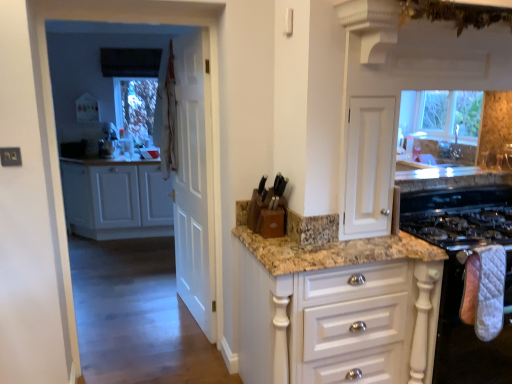
The image size is (512, 384). Describe the element at coordinates (268, 209) in the screenshot. I see `wooden knife block at center, the 1th appliance positioned from the top` at that location.

You are a GUI agent. You are given a task and a screenshot of the screen. Output one action in this format:
    pyautogui.click(x=<x>, y=<y>)
    Task: Click on the white wood cabinets at left, which ranks as the second cabinetry in front-to-back order
    
    Given the screenshot: What is the action you would take?
    pyautogui.click(x=116, y=199)

Identify the location of white wooden door at center. Image resolution: width=512 pixels, height=384 pixels. (194, 181).

The width and height of the screenshot is (512, 384). In order to click on white quilted oven mitt at lower right in this screenshot , I will do `click(467, 340)`.

Where is `white quilted oven mitt at right, which is counted as the second appliance, starting from the top`? white quilted oven mitt at right, which is counted as the second appliance, starting from the top is located at coordinates (463, 274).

Considering the relative sizes of white glossy cabinet at center, the first cabinetry in the right-to-left sequence, and wooden knife block at center, the 1th appliance positioned from the top, in the image provided, is white glossy cabinet at center, the first cabinetry in the right-to-left sequence, bigger than wooden knife block at center, the 1th appliance positioned from the top,?

Correct, white glossy cabinet at center, the first cabinetry in the right-to-left sequence, is larger in size than wooden knife block at center, the 1th appliance positioned from the top.

Is white glossy cabinet at center, which is counted as the first cabinetry, starting from the front, not within wooden knife block at center, the 1th appliance positioned from the top?

Yes.

From a real-world perspective, is white glossy cabinet at center, which is counted as the first cabinetry, starting from the front, on top of wooden knife block at center, the 1th appliance positioned from the top?

No, from a real-world perspective, white glossy cabinet at center, which is counted as the first cabinetry, starting from the front, is not on top of wooden knife block at center, the 1th appliance positioned from the top.

Considering the sizes of objects white glossy cabinet at center, the first cabinetry in the right-to-left sequence, and wooden knife block at center, the 1th appliance in the left-to-right sequence, in the image provided, who is taller, white glossy cabinet at center, the first cabinetry in the right-to-left sequence, or wooden knife block at center, the 1th appliance in the left-to-right sequence,?

white glossy cabinet at center, the first cabinetry in the right-to-left sequence, is taller.

Would you say white wooden door at center contains white glossy cabinet at center, which is the 2th cabinetry in left-to-right order?

That's incorrect, white glossy cabinet at center, which is the 2th cabinetry in left-to-right order, is not inside white wooden door at center.

From a real-world perspective, who is located higher, white wooden door at center or white glossy cabinet at center, which is the 2th cabinetry in left-to-right order?

white wooden door at center is physically above.

From a real-world perspective, who is located higher, white wooden door at center or wooden knife block at center, the 1th appliance in the left-to-right sequence?

In real-world perspective, wooden knife block at center, the 1th appliance in the left-to-right sequence, is above.

Considering the relative sizes of white wooden door at center and wooden knife block at center, the 1th appliance in the left-to-right sequence, in the image provided, is white wooden door at center thinner than wooden knife block at center, the 1th appliance in the left-to-right sequence,?

Yes.

Is white wooden door at center to the left of wooden knife block at center, positioned as the second appliance in right-to-left order, from the viewer's perspective?

Yes.

Is white wooden door at center inside the boundaries of wooden knife block at center, the 1th appliance in the left-to-right sequence, or outside?

white wooden door at center cannot be found inside wooden knife block at center, the 1th appliance in the left-to-right sequence.

Is wooden knife block at center, positioned as the second appliance in right-to-left order, aimed at white wood cabinets at left, which appears as the 2th cabinetry when viewed from the right?

No, wooden knife block at center, positioned as the second appliance in right-to-left order, does not turn towards white wood cabinets at left, which appears as the 2th cabinetry when viewed from the right.

Is point (252, 202) in front of point (86, 225)?

Yes, point (252, 202) is closer to viewer.

From the picture: Who is more distant, wooden knife block at center, positioned as the second appliance in right-to-left order, or white wood cabinets at left, acting as the first cabinetry starting from the back?

white wood cabinets at left, acting as the first cabinetry starting from the back, is further from the camera.

Can you tell me how much wooden knife block at center, positioned as the second appliance in right-to-left order, and white wood cabinets at left, which appears as the 2th cabinetry when viewed from the right, differ in facing direction?

The angular difference between wooden knife block at center, positioned as the second appliance in right-to-left order, and white wood cabinets at left, which appears as the 2th cabinetry when viewed from the right, is 9.22 degrees.

Which object is further away from the camera, white fabric curtain at upper left or white glossy cabinet at center, which is the 2th cabinetry in left-to-right order?

white fabric curtain at upper left is further from the camera.

Is white fabric curtain at upper left next to white glossy cabinet at center, which is the 2th cabinetry in left-to-right order, and touching it?

No, white fabric curtain at upper left is not touching white glossy cabinet at center, which is the 2th cabinetry in left-to-right order.

Is white fabric curtain at upper left oriented away from white glossy cabinet at center, which is counted as the first cabinetry, starting from the front?

No, white fabric curtain at upper left is not facing away from white glossy cabinet at center, which is counted as the first cabinetry, starting from the front.

Is white wood cabinets at left, which ranks as the second cabinetry in front-to-back order, surrounding white glossy cabinet at center, which is counted as the first cabinetry, starting from the front?

No, white glossy cabinet at center, which is counted as the first cabinetry, starting from the front, is not a part of white wood cabinets at left, which ranks as the second cabinetry in front-to-back order.

Is the depth of white wood cabinets at left, which is the first cabinetry from left to right, greater than that of white glossy cabinet at center, which is the 2th cabinetry in left-to-right order?

That is True.

Between white wood cabinets at left, which is the first cabinetry from left to right, and white glossy cabinet at center, which is the 2th cabinetry in left-to-right order, which one has larger size?

Bigger between the two is white wood cabinets at left, which is the first cabinetry from left to right.

Is white wood cabinets at left, which ranks as the second cabinetry in front-to-back order, to the left of white glossy cabinet at center, which is counted as the first cabinetry, starting from the front, from the viewer's perspective?

Yes, white wood cabinets at left, which ranks as the second cabinetry in front-to-back order, is to the left of white glossy cabinet at center, which is counted as the first cabinetry, starting from the front.

Is white wooden door at center located outside white quilted oven mitt at right, the 1th appliance in the bottom-to-top sequence?

white wooden door at center lies outside white quilted oven mitt at right, the 1th appliance in the bottom-to-top sequence,'s area.

Is white wooden door at center facing towards white quilted oven mitt at right, which is counted as the 1th appliance, starting from the right?

No, white wooden door at center is not oriented towards white quilted oven mitt at right, which is counted as the 1th appliance, starting from the right.

Who is more distant, white wooden door at center or white quilted oven mitt at right, which is counted as the second appliance, starting from the top?

white wooden door at center is further away from the camera.

This screenshot has width=512, height=384. Find the location of `cabinetry lying on the right of wooden knife block at center, positioned as the second appliance in right-to-left order`. cabinetry lying on the right of wooden knife block at center, positioned as the second appliance in right-to-left order is located at coordinates (336, 308).

Find the location of a particular element. The width and height of the screenshot is (512, 384). the 2nd cabinetry directly beneath the white wooden door at center (from a real-world perspective) is located at coordinates (336, 308).

From the picture: Considering their positions, is white wooden door at center positioned closer to white wood cabinets at left, which is the first cabinetry from left to right, than white quilted oven mitt at right, which is counted as the 1th appliance, starting from the right?

white wooden door at center is closer to white wood cabinets at left, which is the first cabinetry from left to right.

Looking at this image, estimate the real-world distances between objects in this image. Which object is further from white quilted oven mitt at lower right, white wood cabinets at left, acting as the first cabinetry starting from the back, or wooden knife block at center, the 2th appliance in the bottom-to-top sequence?

Based on the image, white wood cabinets at left, acting as the first cabinetry starting from the back, appears to be further to white quilted oven mitt at lower right.

Estimate the real-world distances between objects in this image. Which object is closer to white glossy cabinet at center, which is counted as the first cabinetry, starting from the front, wooden knife block at center, the 1th appliance in the left-to-right sequence, or white fabric curtain at upper left?

wooden knife block at center, the 1th appliance in the left-to-right sequence, lies closer to white glossy cabinet at center, which is counted as the first cabinetry, starting from the front, than the other object.

When comparing their distances from wooden knife block at center, the 2th appliance in the bottom-to-top sequence, does white wood cabinets at left, which is the first cabinetry from left to right, or white quilted oven mitt at right, which is counted as the second appliance, starting from the top, seem further?

white wood cabinets at left, which is the first cabinetry from left to right, is positioned further to the anchor wooden knife block at center, the 2th appliance in the bottom-to-top sequence.

Considering their positions, is white quilted oven mitt at right, the 1th appliance in the bottom-to-top sequence, positioned closer to white wood cabinets at left, which ranks as the second cabinetry in front-to-back order, than wooden knife block at center, the 1th appliance positioned from the top?

The object closer to white wood cabinets at left, which ranks as the second cabinetry in front-to-back order, is wooden knife block at center, the 1th appliance positioned from the top.

Considering their positions, is white quilted oven mitt at lower right positioned further to white fabric curtain at upper left than white wooden door at center?

Based on the image, white quilted oven mitt at lower right appears to be further to white fabric curtain at upper left.

Consider the image. Based on their spatial positions, is white fabric curtain at upper left or white quilted oven mitt at lower right closer to white wood cabinets at left, which ranks as the second cabinetry in front-to-back order?

white fabric curtain at upper left is positioned closer to the anchor white wood cabinets at left, which ranks as the second cabinetry in front-to-back order.

From the image, which object appears to be nearer to white wood cabinets at left, acting as the first cabinetry starting from the back, white wooden door at center or white quilted oven mitt at lower right?

The object closer to white wood cabinets at left, acting as the first cabinetry starting from the back, is white wooden door at center.

Identify the location of appliance situated between white wooden door at center and white quilted oven mitt at lower right from left to right. The height and width of the screenshot is (384, 512). (268, 209).

This screenshot has width=512, height=384. Identify the location of door located between white fabric curtain at upper left and white quilted oven mitt at lower right in the left-right direction. (194, 181).

Where is `curtain between white wood cabinets at left, which ranks as the second cabinetry in front-to-back order, and white quilted oven mitt at lower right, in the horizontal direction`? curtain between white wood cabinets at left, which ranks as the second cabinetry in front-to-back order, and white quilted oven mitt at lower right, in the horizontal direction is located at coordinates [167, 120].

You are a GUI agent. You are given a task and a screenshot of the screen. Output one action in this format:
    pyautogui.click(x=<x>, y=<y>)
    Task: Click on the appliance between white wooden door at center and white quilted oven mitt at right, the 1th appliance in the bottom-to-top sequence, in the horizontal direction
    
    Given the screenshot: What is the action you would take?
    tap(268, 209)